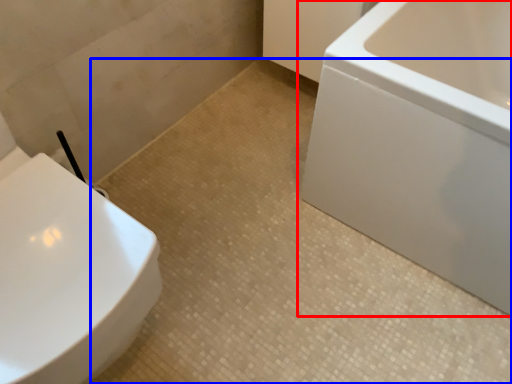
Question: Which point is further to the camera, bathtub (highlighted by a red box) or ceramic tile (highlighted by a blue box)?

Choices:
 (A) bathtub
 (B) ceramic tile

Answer: (B)